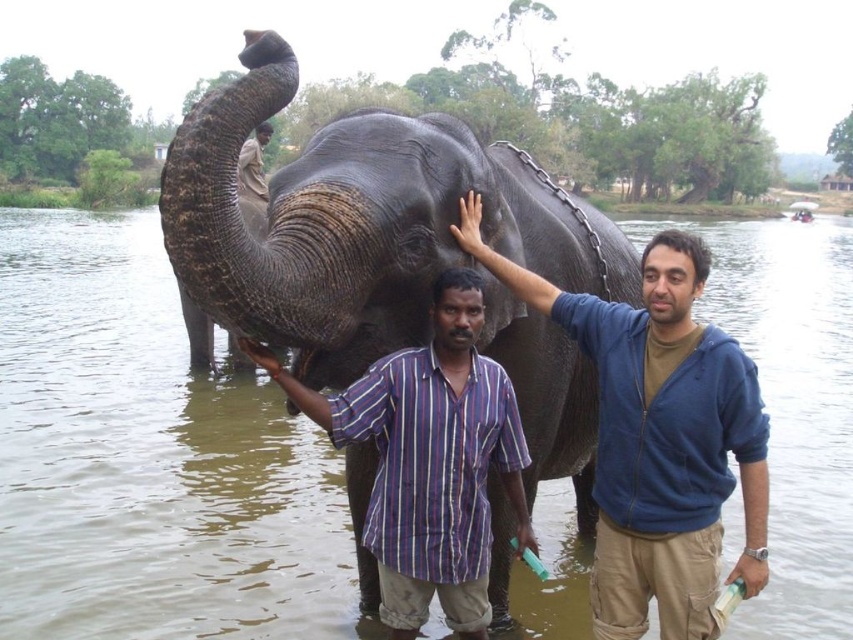
Question: Can you confirm if green murky water at center is positioned to the right of gray textured elephant at center?

Choices:
 (A) yes
 (B) no

Answer: (A)

Question: Considering the real-world distances, which object is farthest from the brown cotton shirt at upper center?

Choices:
 (A) gray textured elephant at center
 (B) striped cotton shirt at center

Answer: (B)

Question: Based on their relative distances, which object is farther from the brown cotton shirt at upper center?

Choices:
 (A) green murky water at center
 (B) blue zip-up hoodie at center
 (C) gray textured elephant at center

Answer: (A)

Question: Based on their relative distances, which object is nearer to the gray textured elephant at center?

Choices:
 (A) striped cotton shirt at center
 (B) brown cotton shirt at upper center
 (C) green murky water at center

Answer: (A)

Question: Can you confirm if green murky water at center is smaller than blue zip-up hoodie at center?

Choices:
 (A) yes
 (B) no

Answer: (B)

Question: Can you confirm if gray textured elephant at center is positioned to the left of brown cotton shirt at upper center?

Choices:
 (A) no
 (B) yes

Answer: (A)